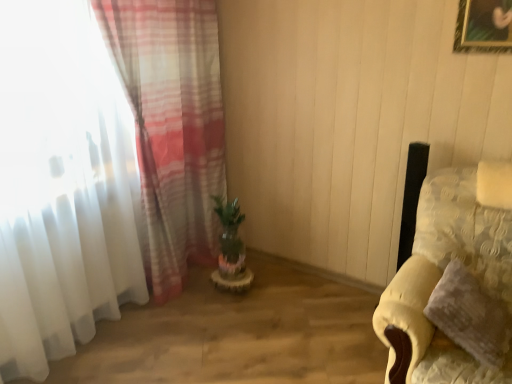
Question: In the image, is fluffy yellow pillow at right on the left side or the right side of green matte plant at center?

Choices:
 (A) left
 (B) right

Answer: (B)

Question: Is point (453, 296) closer or farther from the camera than point (236, 213)?

Choices:
 (A) closer
 (B) farther

Answer: (A)

Question: Which object is the farthest from the yellow fabric couch at right?

Choices:
 (A) translucent fabric curtain at left
 (B) fluffy yellow pillow at right
 (C) green matte plant at center

Answer: (A)

Question: Estimate the real-world distances between objects in this image. Which object is farther from the green matte plant at center?

Choices:
 (A) translucent fabric curtain at left
 (B) fluffy yellow pillow at right
 (C) yellow fabric couch at right

Answer: (B)